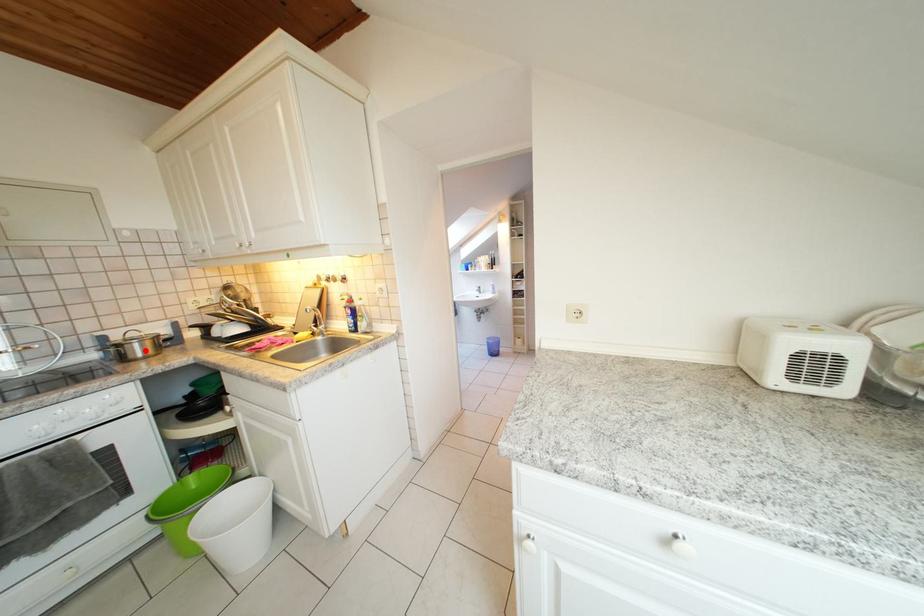
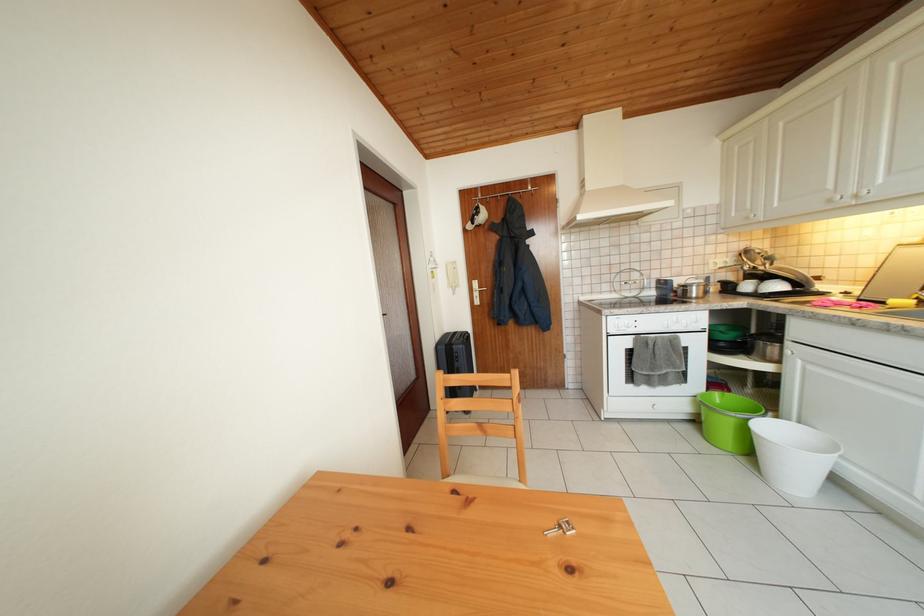
Locate, in the second image, the point that corresponds to the highlighted location in the first image.

(702, 294)